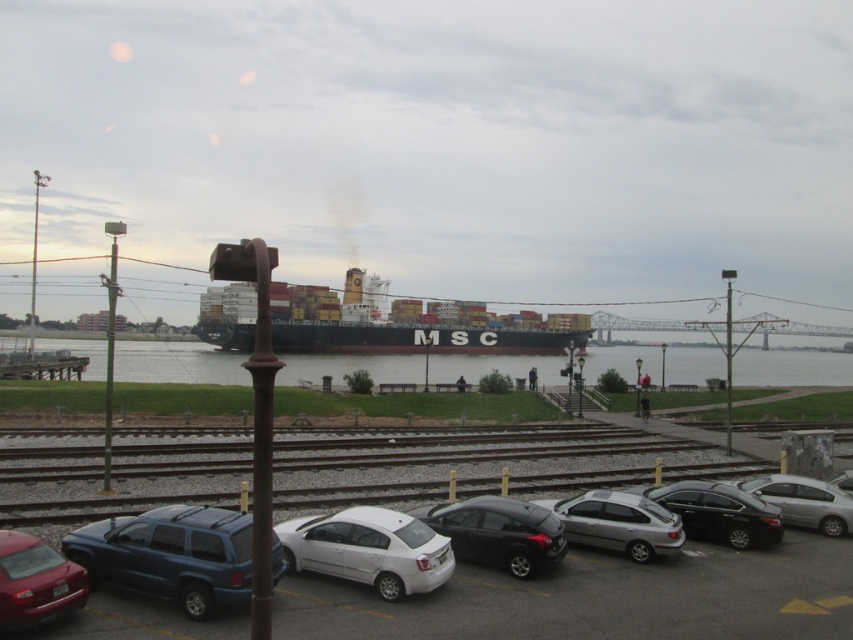
This screenshot has width=853, height=640. Describe the element at coordinates (498, 532) in the screenshot. I see `shiny black hatchback at center` at that location.

Does point (424, 509) lie behind point (41, 547)?

Yes, point (424, 509) is farther from viewer.

Which is in front, point (469, 522) or point (86, 580)?

Point (86, 580) is more forward.

Image resolution: width=853 pixels, height=640 pixels. What are the coordinates of `shiny black hatchback at center` in the screenshot? It's located at (498, 532).

Can you confirm if clear water at center is taller than matte red sedan at lower left?

Yes, clear water at center is taller than matte red sedan at lower left.

Can you confirm if clear water at center is positioned below matte red sedan at lower left?

Indeed, clear water at center is positioned under matte red sedan at lower left.

Is point (642, 355) positioned behind point (42, 548)?

Yes, point (642, 355) is behind point (42, 548).

At what (x,y) coordinates should I click in order to perform the action: click on clear water at center. Please return your answer as a coordinate pair (x, y). The height and width of the screenshot is (640, 853). Looking at the image, I should click on (177, 364).

Can you confirm if metallic silver car at lower center is bigger than matte red sedan at lower left?

Correct, metallic silver car at lower center is larger in size than matte red sedan at lower left.

Is metallic silver car at lower center to the right of matte red sedan at lower left from the viewer's perspective?

Correct, you'll find metallic silver car at lower center to the right of matte red sedan at lower left.

Between point (100, 604) and point (47, 618), which one is positioned in front?

Point (47, 618) is more forward.

Where is `metallic silver car at lower center`? The height and width of the screenshot is (640, 853). metallic silver car at lower center is located at coordinates (599, 600).